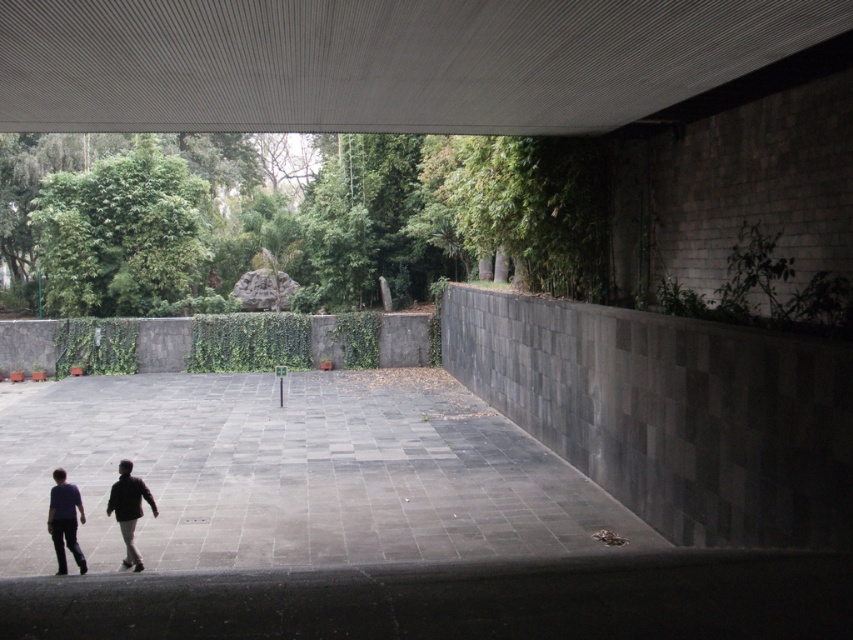
Consider the image. How much distance is there between dark gray pants at lower left and dark blue jeans at lower left?

dark gray pants at lower left and dark blue jeans at lower left are 62.26 centimeters apart.

Does dark gray pants at lower left lie behind dark blue jeans at lower left?

Yes, it is.

Does point (129, 472) come farther from viewer compared to point (51, 522)?

Yes, point (129, 472) is behind point (51, 522).

Where is `dark gray pants at lower left`? The image size is (853, 640). dark gray pants at lower left is located at coordinates (128, 508).

Image resolution: width=853 pixels, height=640 pixels. What do you see at coordinates (383, 61) in the screenshot? I see `smooth concrete ceiling at upper center` at bounding box center [383, 61].

How far apart are smooth concrete ceiling at upper center and dark blue jeans at lower left?

smooth concrete ceiling at upper center is 20.45 feet from dark blue jeans at lower left.

Identify the location of smooth concrete ceiling at upper center. (383, 61).

You are a GUI agent. You are given a task and a screenshot of the screen. Output one action in this format:
    pyautogui.click(x=<x>, y=<y>)
    Task: Click on the smooth concrete ceiling at upper center
    This screenshot has width=853, height=640.
    Given the screenshot: What is the action you would take?
    pyautogui.click(x=383, y=61)

From the picture: Does gray stone path at center lie behind dark brown leather jacket at lower left?

Yes, gray stone path at center is behind dark brown leather jacket at lower left.

Is point (489, 506) less distant than point (136, 564)?

No, (489, 506) is further to viewer.

Locate an element on the screen. gray stone path at center is located at coordinates (291, 472).